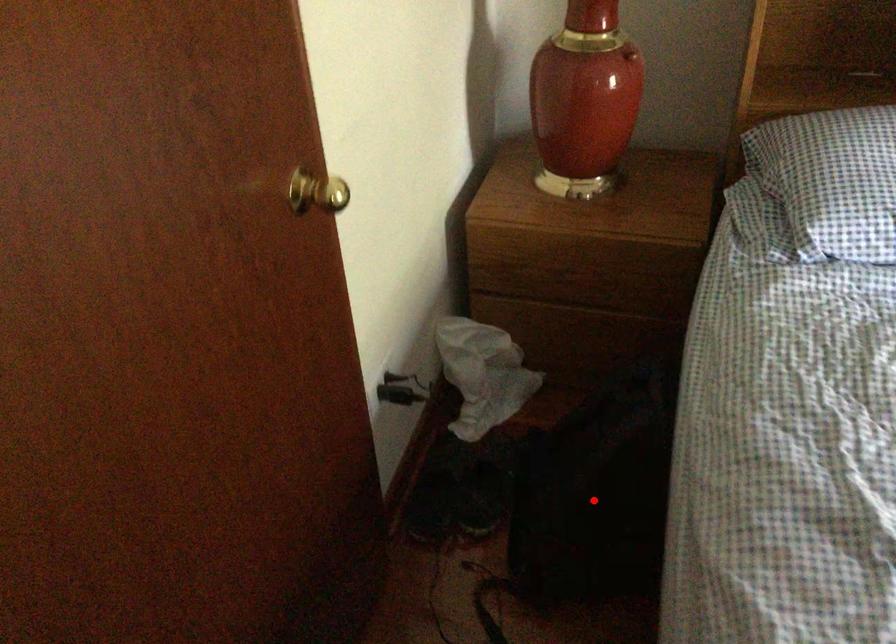
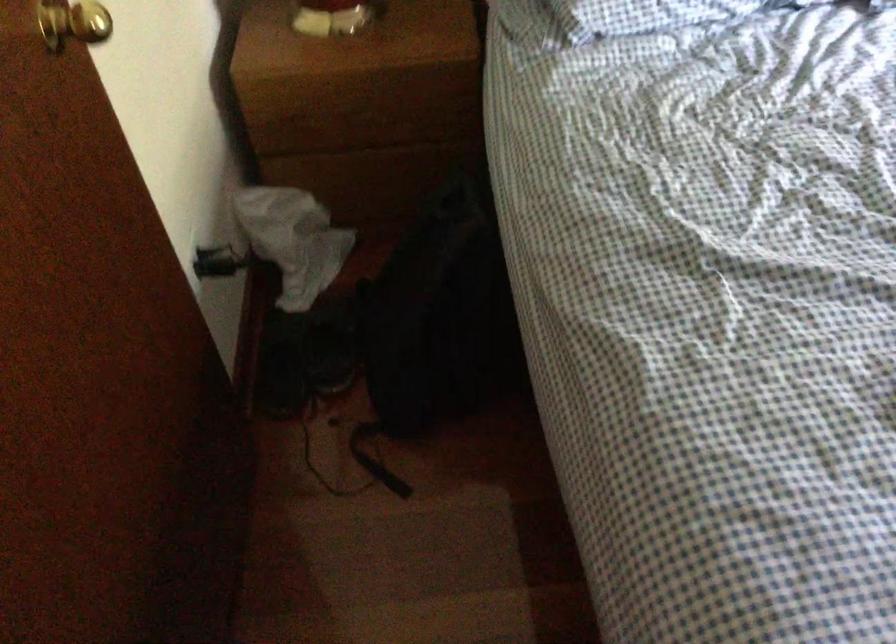
Find the pixel in the second image that matches the highlighted location in the first image.

(441, 317)